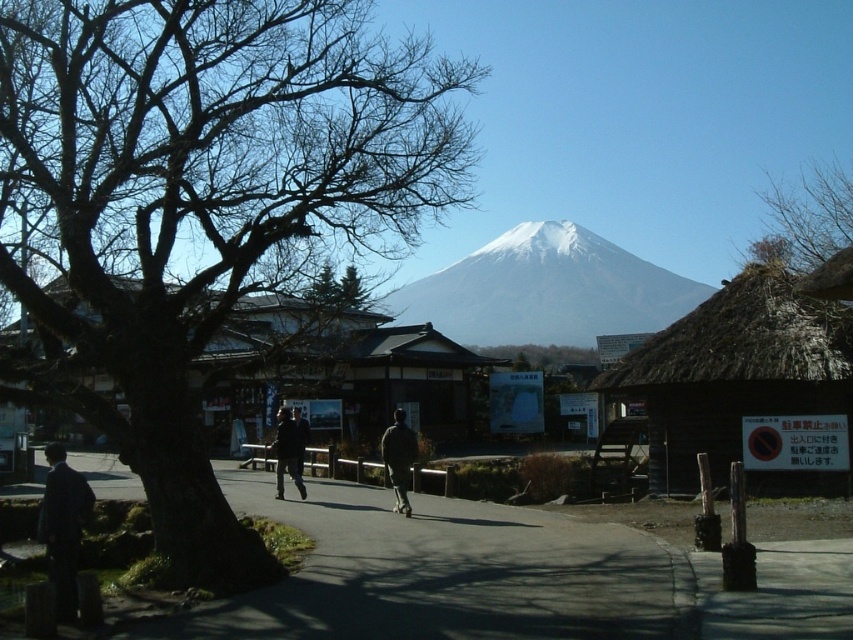
You are standing at the base of Mount Fuji and see two points marked in the image. The first point is at coordinates point (604, 272) and the second is at point (47, 563). Which point is closer to you?

Point (604, 272) is further to the camera than point (47, 563), so the point closer to you is point (47, 563).